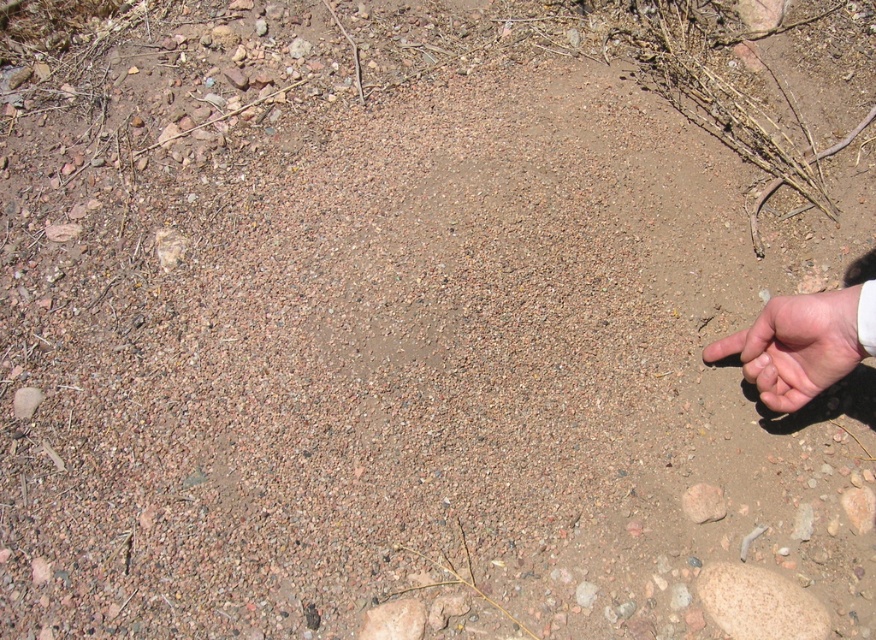
Question: Can you confirm if skinny white hand at lower right is positioned above brown rough stone at center?

Choices:
 (A) no
 (B) yes

Answer: (B)

Question: Does skinny white hand at lower right have a smaller size compared to brown rough stone at center?

Choices:
 (A) yes
 (B) no

Answer: (B)

Question: In this image, where is skinny white hand at lower right located relative to brown rough stone at center?

Choices:
 (A) left
 (B) right

Answer: (B)

Question: Which point appears farthest from the camera in this image?

Choices:
 (A) (845, 291)
 (B) (804, 611)

Answer: (B)

Question: Which point is farther to the camera?

Choices:
 (A) brown rough stone at center
 (B) skinny white hand at lower right

Answer: (A)

Question: Which point is closer to the camera taking this photo?

Choices:
 (A) (763, 572)
 (B) (765, 400)

Answer: (B)